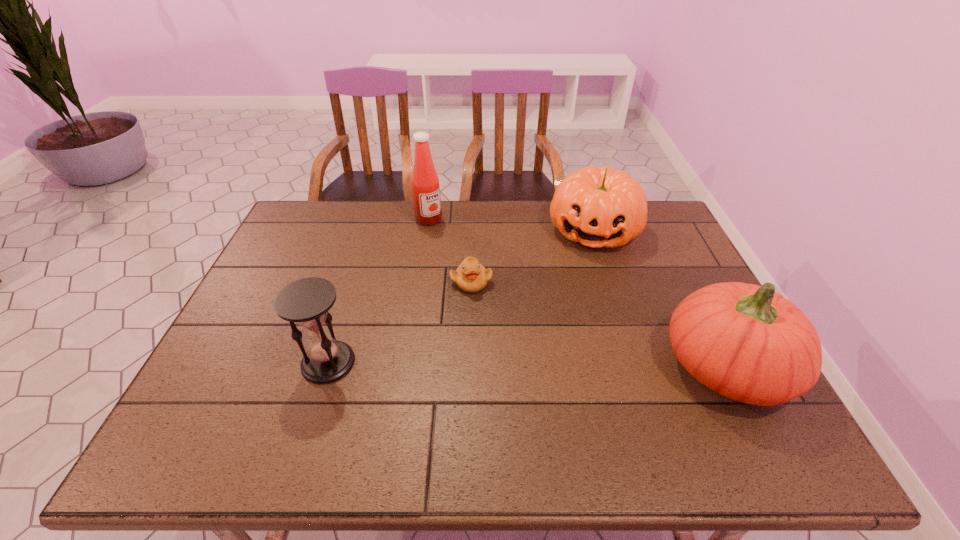
Find the location of `free space between the farther pumpkin and the hourglass`. free space between the farther pumpkin and the hourglass is located at coordinates (461, 296).

Where is `the fourth closest object to the nearer pumpkin`? This screenshot has width=960, height=540. the fourth closest object to the nearer pumpkin is located at coordinates 306,301.

At what (x,y) coordinates should I click in order to perform the action: click on object that is the closest to the shortest object. Please return your answer as a coordinate pair (x, y). Looking at the image, I should click on (598, 207).

The image size is (960, 540). I want to click on vacant space that satisfies the following two spatial constraints: 1. on the back side of the shorter pumpkin; 2. on the right side of the leftmost object, so click(x=370, y=230).